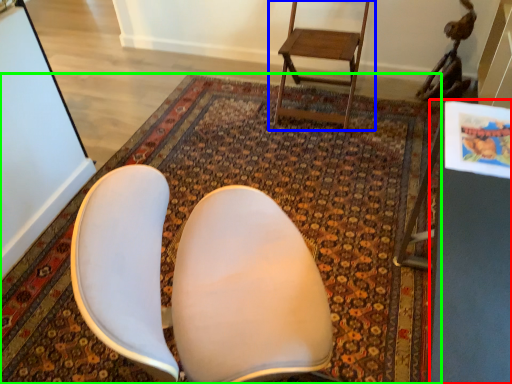
Question: Which object is positioned closest to table (highlighted by a red box)? Select from chair (highlighted by a blue box) and mat (highlighted by a green box).

Choices:
 (A) chair
 (B) mat

Answer: (B)